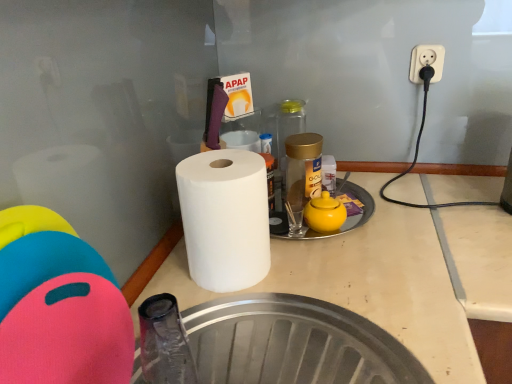
You are a GUI agent. You are given a task and a screenshot of the screen. Output one action in this format:
    pyautogui.click(x=<x>, y=<y>)
    Task: Click on the free space in front of gold metallic jar at center, which appears as the second bottle when viewed from the back
    Image resolution: width=512 pixels, height=384 pixels.
    Given the screenshot: What is the action you would take?
    pyautogui.click(x=294, y=232)